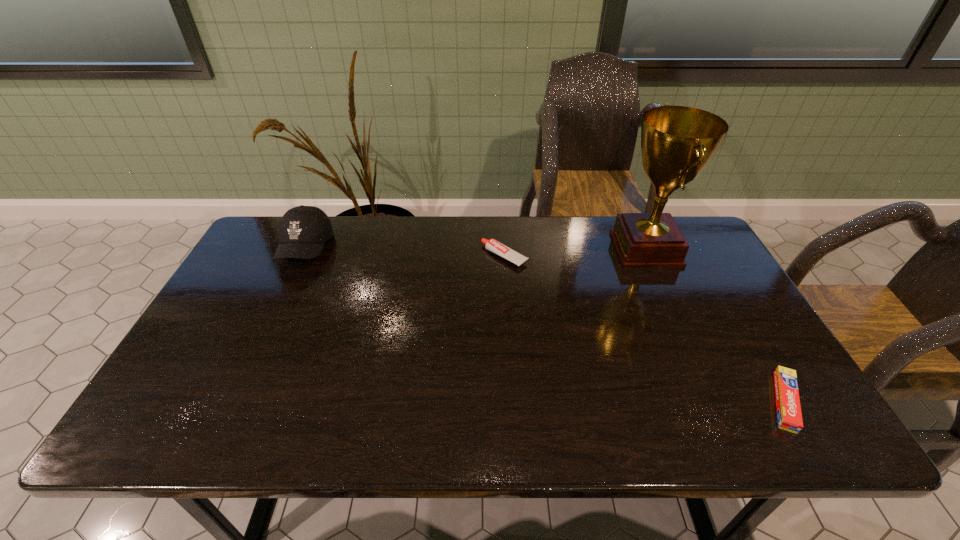
Select which object is the third closest to the shortest object. Please provide its 2D coordinates. Your answer should be formatted as a tuple, i.e. [(x, y)], where the tuple contains the x and y coordinates of a point satisfying the conditions above.

[(303, 230)]

Where is `free space that satisfies the following two spatial constraints: 1. on the front-facing side of the third object from right to left; 2. on the left side of the leftmost object`? Image resolution: width=960 pixels, height=540 pixels. free space that satisfies the following two spatial constraints: 1. on the front-facing side of the third object from right to left; 2. on the left side of the leftmost object is located at coordinates (301, 256).

Identify the location of free space that satisfies the following two spatial constraints: 1. on the plaque of the award; 2. on the front side of the third tallest object. The height and width of the screenshot is (540, 960). (649, 256).

Locate an element on the screen. vacant point that satisfies the following two spatial constraints: 1. on the plaque of the right toothpaste; 2. on the right side of the award is located at coordinates (714, 402).

This screenshot has width=960, height=540. I want to click on vacant region that satisfies the following two spatial constraints: 1. on the front-facing side of the second tallest object; 2. on the left side of the rightmost object, so click(233, 402).

Where is `blank area in the image that satisfies the following two spatial constraints: 1. on the front-facing side of the left toothpaste; 2. on the left side of the baseball cap`? Image resolution: width=960 pixels, height=540 pixels. blank area in the image that satisfies the following two spatial constraints: 1. on the front-facing side of the left toothpaste; 2. on the left side of the baseball cap is located at coordinates (301, 256).